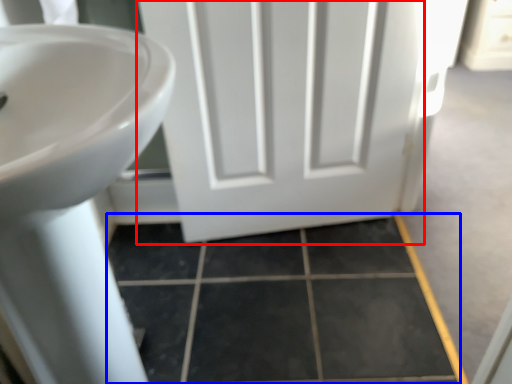
Question: Which object appears farthest to the camera in this image, door (highlighted by a red box) or tile (highlighted by a blue box)?

Choices:
 (A) door
 (B) tile

Answer: (B)